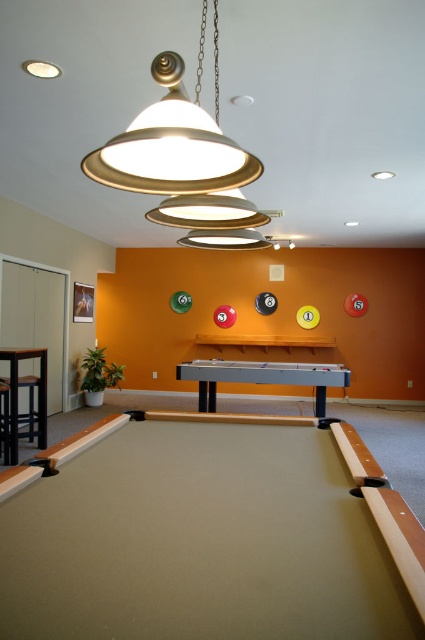
You are a person of average height standing in the recreational room. You want to place a small decorative item on the smooth gray pool table at center. However, you need to step onto the black leather stool at lower left to reach the table. Is this possible?

The smooth gray pool table at center has a lesser height compared to black leather stool at lower left. Since the stool is taller than the table, you can step onto the stool to easily reach the table and place the decorative item.

You are a guest in the recreational room and want to sit down on the black leather stool at lower left. Can you easily reach the smooth gray pool table at center from your seated position?

The black leather stool at lower left is behind the smooth gray pool table at center, so when you sit on it, you will be facing away from the table. Therefore, you cannot easily reach the smooth gray pool table at center from your seated position.

You are playing pool and want to place your black leather stool at lower left near the smooth gray pool table at center. Based on the scene description, which side of the pool table should you position your stool to ensure it is correctly placed according to the room layout?

The smooth gray pool table at center is to the right of the black leather stool at lower left, so you should position your stool to the left side of the pool table to align with the described layout.